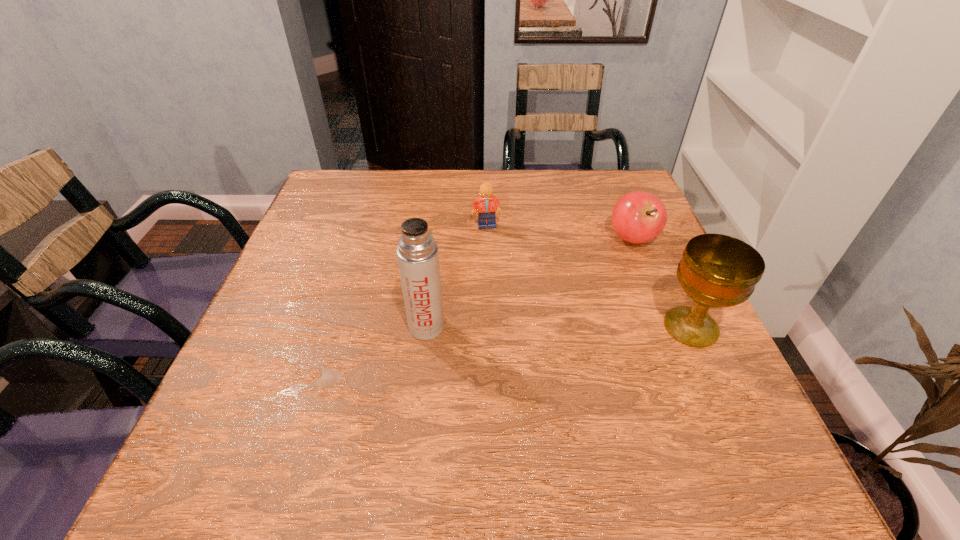
The height and width of the screenshot is (540, 960). Identify the location of free region located 0.230m on the stem of the apple. (585, 310).

The height and width of the screenshot is (540, 960). Find the location of `free space located 0.120m on the stem of the apple`. free space located 0.120m on the stem of the apple is located at coordinates (605, 280).

Find the location of `vacant region located 0.240m on the stem of the apple`. vacant region located 0.240m on the stem of the apple is located at coordinates (583, 313).

Where is `chalice at the right edge`? The width and height of the screenshot is (960, 540). chalice at the right edge is located at coordinates (716, 271).

Identify the location of apple present at the right edge. (638, 216).

Where is `vacant space at the far edge of the desktop`? vacant space at the far edge of the desktop is located at coordinates (471, 178).

The height and width of the screenshot is (540, 960). What are the coordinates of `vacant position at the left edge of the desktop` in the screenshot? It's located at (334, 252).

In the image, there is a desktop. Identify the location of vacant space at the right edge. (624, 264).

The width and height of the screenshot is (960, 540). Find the location of `free point at the far left corner`. free point at the far left corner is located at coordinates (363, 173).

The height and width of the screenshot is (540, 960). Identify the location of vacant region at the far right corner of the desktop. (598, 180).